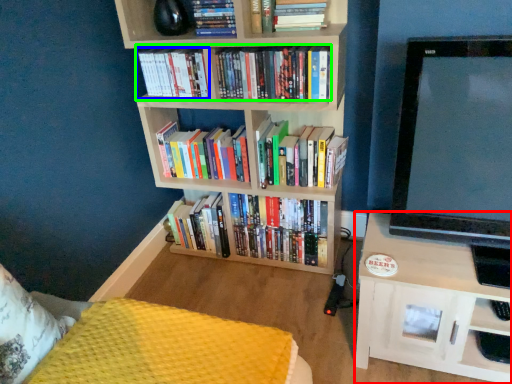
Question: Which object is positioned farthest from shelf (highlighted by a red box)? Select from book (highlighted by a blue box) and book (highlighted by a green box).

Choices:
 (A) book
 (B) book

Answer: (A)